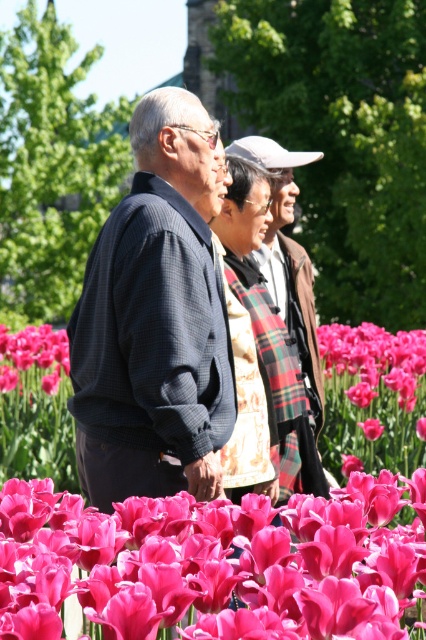
Is pink silky tulips at center wider than dark blue textured jacket at center?

Yes.

Can you confirm if pink silky tulips at center is taller than dark blue textured jacket at center?

Incorrect, pink silky tulips at center's height is not larger of dark blue textured jacket at center's.

Who is more forward, (x=388, y=476) or (x=170, y=253)?

Point (x=388, y=476)

Locate an element on the screen. pink silky tulips at center is located at coordinates (244, 532).

Who is more forward, (278,413) or (360,401)?

Positioned in front is point (278,413).

The image size is (426, 640). What do you see at coordinates (268, 328) in the screenshot? I see `plaid fabric scarf at center` at bounding box center [268, 328].

Find the location of a particular element. plaid fabric scarf at center is located at coordinates (268, 328).

Is dark blue textured jacket at center wider than pink matte tulip at lower center?

Yes, dark blue textured jacket at center is wider than pink matte tulip at lower center.

Between dark blue textured jacket at center and pink matte tulip at lower center, which one is positioned higher?

dark blue textured jacket at center is above.

The image size is (426, 640). Identify the location of dark blue textured jacket at center. (155, 321).